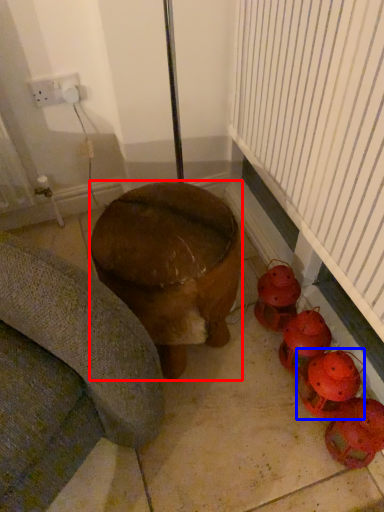
Question: Among these objects, which one is farthest to the camera, furniture (highlighted by a red box) or toy (highlighted by a blue box)?

Choices:
 (A) furniture
 (B) toy

Answer: (B)